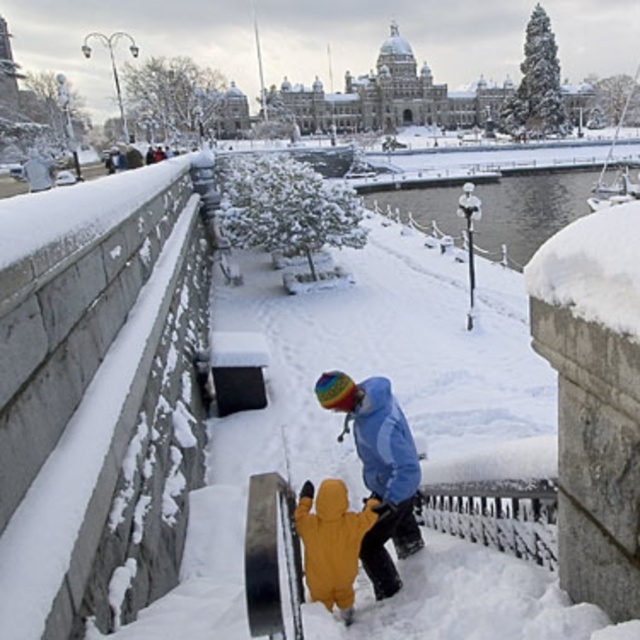
Question: Which object is farther from the camera taking this photo?

Choices:
 (A) yellow fleece jacket at center
 (B) matte blue jacket at center

Answer: (B)

Question: Does yellow fleece jacket at center lie behind yellow fuzzy snowsuit at center?

Choices:
 (A) no
 (B) yes

Answer: (B)

Question: Which object appears farthest from the camera in this image?

Choices:
 (A) matte blue jacket at center
 (B) yellow fuzzy snowsuit at center

Answer: (A)

Question: Which of these objects is positioned closest to the yellow fleece jacket at center?

Choices:
 (A) yellow fuzzy snowsuit at center
 (B) matte blue jacket at center

Answer: (A)

Question: Can you confirm if yellow fuzzy snowsuit at center is bigger than matte blue jacket at center?

Choices:
 (A) yes
 (B) no

Answer: (A)

Question: Can you confirm if yellow fleece jacket at center is positioned to the left of matte blue jacket at center?

Choices:
 (A) no
 (B) yes

Answer: (B)